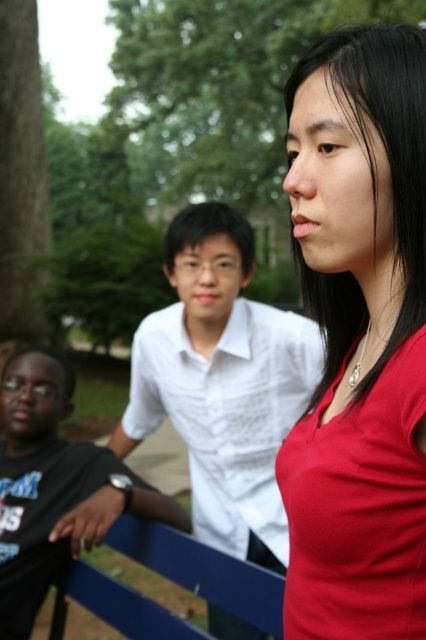
You are trying to decide which shirt to wear for a casual day out. Both the white cotton shirt at center and the black matte shirt at left are options. Based on the image, which shirt has a wider cut?

The white cotton shirt at center is wider than the black matte shirt at left according to the description.

You are a photographer setting up for a group photo. You need to position two subjects wearing a white cotton shirt at center and a black matte shirt at left so that they are exactly 15 inches apart. Based on the current scene, do you need to move them closer or farther apart?

The white cotton shirt at center is currently 14.78 inches from the black matte shirt at left. Since the desired distance is 15 inches, they need to move slightly farther apart to reach the required distance.

Consider the image. You are standing in a park and see two people wearing shirts. One is a matte red shirt at right and the other is a black matte shirt at left. Which shirt is covering part of the other?

The matte red shirt at right is positioned over black matte shirt at left, so it is covering part of the black matte shirt at left.